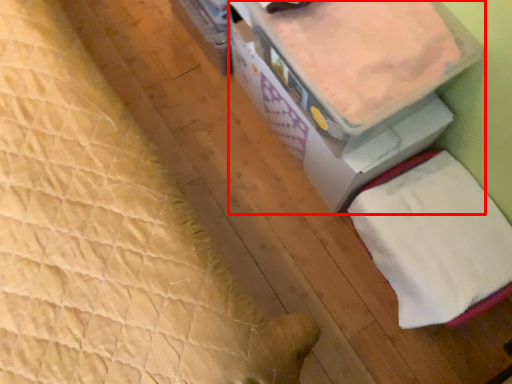
Question: Where is storage box (annotated by the red box) located in relation to sheet in the image?

Choices:
 (A) right
 (B) left

Answer: (B)